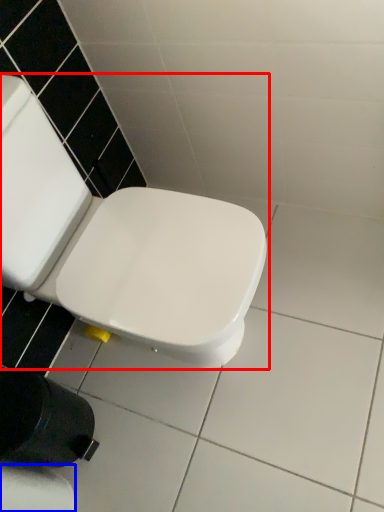
Question: Which point is closer to the camera, toilet (highlighted by a red box) or toilet paper (highlighted by a blue box)?

Choices:
 (A) toilet
 (B) toilet paper

Answer: (A)